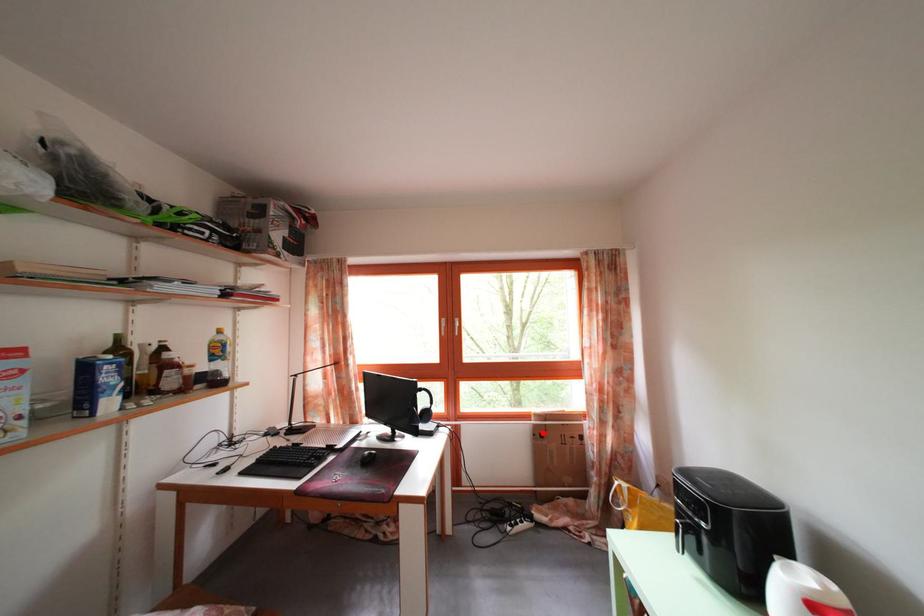
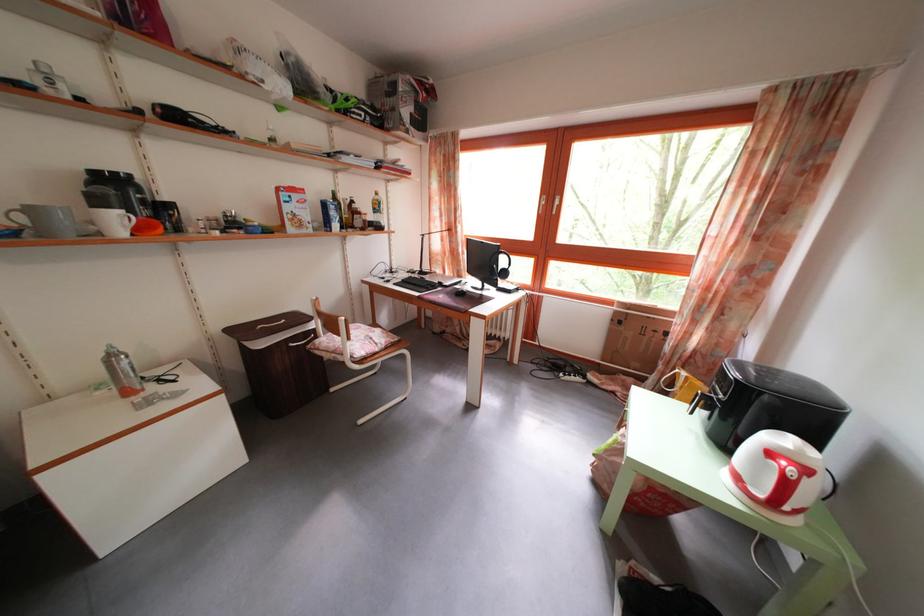
Question: I am providing you with two images of the same scene from different viewpoints. In image1, a red point is highlighted. Considering the same 3D point in image2, which of the following is correct?

Choices:
 (A) It is closer
 (B) It is farther

Answer: (A)